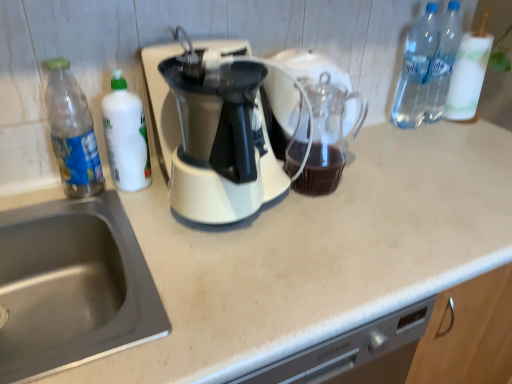
Question: Is transparent glass carafe at center taller than clear plastic bottle at upper right, the 4th bottle when ordered from left to right?

Choices:
 (A) no
 (B) yes

Answer: (A)

Question: Is transparent glass carafe at center to the left of clear plastic bottle at upper right, the first bottle from the right, from the viewer's perspective?

Choices:
 (A) yes
 (B) no

Answer: (A)

Question: From a real-world perspective, is transparent glass carafe at center on clear plastic bottle at upper right, the 4th bottle when ordered from left to right?

Choices:
 (A) no
 (B) yes

Answer: (A)

Question: Is transparent glass carafe at center not inside clear plastic bottle at upper right, the first bottle from the right?

Choices:
 (A) no
 (B) yes

Answer: (B)

Question: From the image's perspective, is transparent glass carafe at center under clear plastic bottle at upper right, the first bottle from the right?

Choices:
 (A) no
 (B) yes

Answer: (B)

Question: In terms of size, does clear plastic bottle at upper right, the 4th bottle when ordered from left to right, appear bigger or smaller than clear plastic bottles at upper right, the 3th bottle positioned from the left?

Choices:
 (A) small
 (B) big

Answer: (B)

Question: From the image's perspective, is clear plastic bottle at upper right, the first bottle from the right, above or below clear plastic bottles at upper right, placed as the 2th bottle when sorted from right to left?

Choices:
 (A) above
 (B) below

Answer: (A)

Question: In the image, is clear plastic bottle at upper right, the 4th bottle when ordered from left to right, positioned in front of or behind clear plastic bottles at upper right, placed as the 2th bottle when sorted from right to left?

Choices:
 (A) front
 (B) behind

Answer: (A)

Question: Considering the positions of point (470, 104) and point (414, 26), is point (470, 104) closer or farther from the camera than point (414, 26)?

Choices:
 (A) farther
 (B) closer

Answer: (A)

Question: Considering the positions of point (119, 264) and point (278, 332), is point (119, 264) closer or farther from the camera than point (278, 332)?

Choices:
 (A) closer
 (B) farther

Answer: (B)

Question: In the image, is stainless steel sink at lower left on the left side or the right side of beige laminate counter at center?

Choices:
 (A) left
 (B) right

Answer: (A)

Question: Considering the positions of stainless steel sink at lower left and beige laminate counter at center in the image, is stainless steel sink at lower left taller or shorter than beige laminate counter at center?

Choices:
 (A) tall
 (B) short

Answer: (B)

Question: From the image's perspective, is stainless steel sink at lower left positioned above or below beige laminate counter at center?

Choices:
 (A) below
 (B) above

Answer: (B)

Question: From the image's perspective, is stainless steel sink at lower left above or below transparent glass carafe at center?

Choices:
 (A) above
 (B) below

Answer: (B)

Question: Is stainless steel sink at lower left wider or thinner than transparent glass carafe at center?

Choices:
 (A) wide
 (B) thin

Answer: (A)